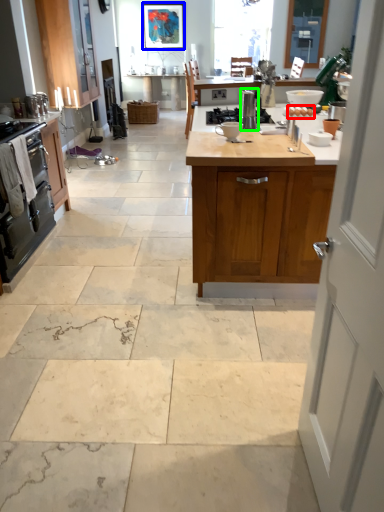
Question: Based on their relative distances, which object is farther from food (highlighted by a red box)? Choose from picture frame (highlighted by a blue box) and appliance (highlighted by a green box).

Choices:
 (A) picture frame
 (B) appliance

Answer: (A)